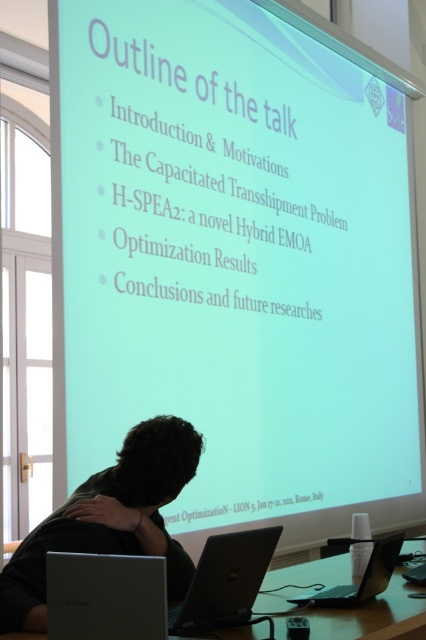
Question: Does white plastic table at lower center come behind black plastic laptop at lower center?

Choices:
 (A) no
 (B) yes

Answer: (A)

Question: Which point is closer to the camera?

Choices:
 (A) tap(322, 580)
 (B) tap(169, 483)
 (C) tap(385, 538)

Answer: (B)

Question: Does silver metallic laptop at lower left appear under black plastic laptop at lower center?

Choices:
 (A) no
 (B) yes

Answer: (A)

Question: Which point is farther to the camera?

Choices:
 (A) (42, 573)
 (B) (259, 557)
 (C) (382, 550)

Answer: (C)

Question: Which point is closer to the camera taking this photo?

Choices:
 (A) (319, 563)
 (B) (37, 618)
 (C) (379, 579)
 (D) (258, 576)

Answer: (B)

Question: Is silver metallic laptop at lower left positioned before black plastic laptop at lower center?

Choices:
 (A) yes
 (B) no

Answer: (A)